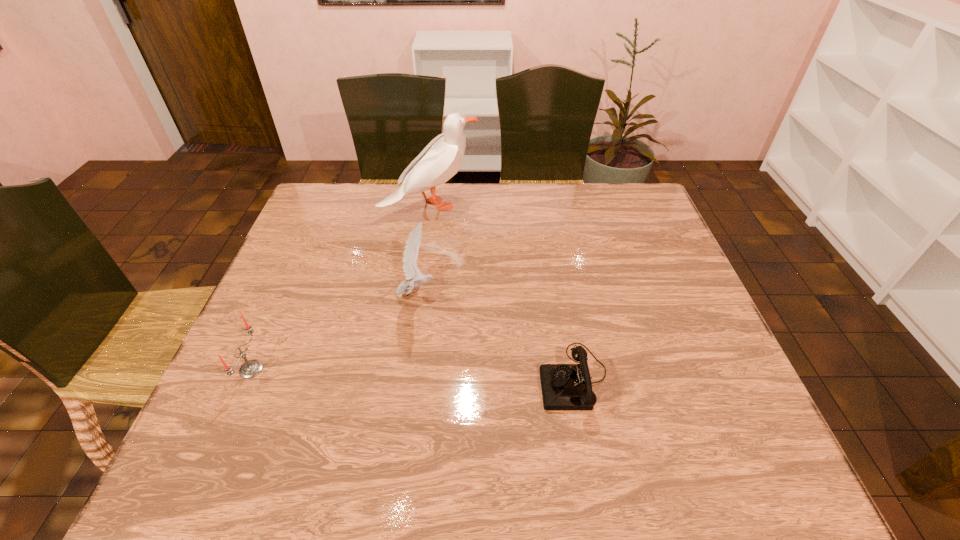
Where is `free space between the leftmost object and the shorter gull`? The height and width of the screenshot is (540, 960). free space between the leftmost object and the shorter gull is located at coordinates (334, 332).

Locate an element on the screen. The width and height of the screenshot is (960, 540). vacant area that lies between the nearer gull and the rightmost object is located at coordinates (495, 336).

Where is `free space between the rightmost object and the farther gull`? The width and height of the screenshot is (960, 540). free space between the rightmost object and the farther gull is located at coordinates (502, 292).

Where is `free space between the shorter gull and the farther gull`? free space between the shorter gull and the farther gull is located at coordinates (423, 249).

You are a GUI agent. You are given a task and a screenshot of the screen. Output one action in this format:
    pyautogui.click(x=<x>, y=<y>)
    Task: Click on the vacant space that is in between the shorter gull and the farther gull
    Image resolution: width=960 pixels, height=540 pixels.
    Given the screenshot: What is the action you would take?
    click(423, 249)

The image size is (960, 540). I want to click on free space between the third nearest object and the rightmost object, so click(x=495, y=336).

Where is `vacant space in between the shorter gull and the candle`? vacant space in between the shorter gull and the candle is located at coordinates (334, 332).

The height and width of the screenshot is (540, 960). I want to click on vacant space that's between the leftmost object and the nearer gull, so click(x=334, y=332).

I want to click on free spot between the candle and the second farthest object, so click(334, 332).

Image resolution: width=960 pixels, height=540 pixels. Find the location of `empty space between the taller gull and the leftmost object`. empty space between the taller gull and the leftmost object is located at coordinates (341, 287).